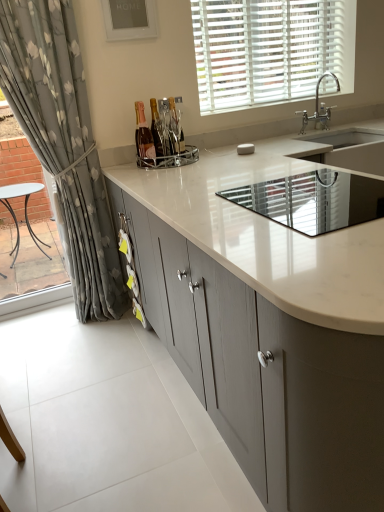
Question: Is silver metallic faucet at upper right to the left or to the right of matte gray cabinets at center in the image?

Choices:
 (A) left
 (B) right

Answer: (B)

Question: Is silver metallic faucet at upper right wider or thinner than matte gray cabinets at center?

Choices:
 (A) thin
 (B) wide

Answer: (A)

Question: Estimate the real-world distances between objects in this image. Which object is farther from the black glass cooktop at center, positioned as the first appliance in bottom-to-top order?

Choices:
 (A) floral fabric curtain at left
 (B) white matte blinds at upper center
 (C) matte glass bottle at center, which appears as the 2th bottle when viewed from the left
 (D) chrome metallic wine rack at center, the second appliance viewed from the right
 (E) silver metallic faucet at upper right

Answer: (E)

Question: Based on their relative distances, which object is nearer to the white matte blinds at upper center?

Choices:
 (A) white glossy sink at center
 (B) chrome metallic wine rack at center, the 1th appliance from the top
 (C) floral fabric curtain at left
 (D) matte glass bottle at center, positioned as the first bottle in right-to-left order
 (E) matte glass bottle at center, positioned as the 2th bottle in right-to-left order

Answer: (D)